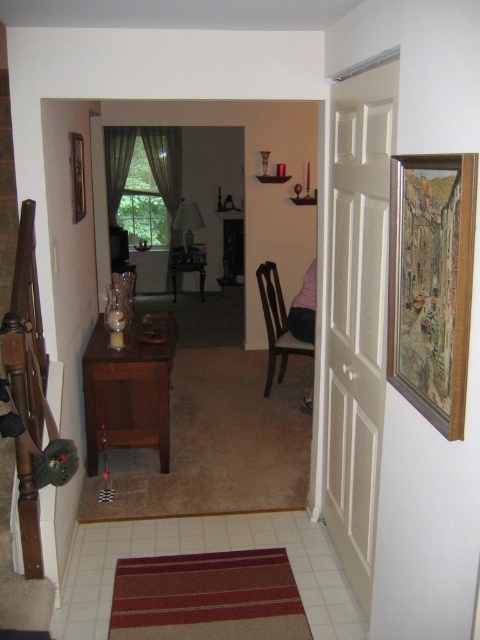
Question: Does matte wood table at center appear on the right side of wooden table at center?

Choices:
 (A) no
 (B) yes

Answer: (B)

Question: Which point is closer to the camera?

Choices:
 (A) (204, 266)
 (B) (113, 390)

Answer: (B)

Question: Which of the following is the closest to the observer?

Choices:
 (A) (171, 272)
 (B) (304, 349)
 (C) (113, 419)

Answer: (C)

Question: Which object is farther from the camera taking this photo?

Choices:
 (A) matte wood table at center
 (B) wooden table at center
 (C) wooden chair at center

Answer: (B)

Question: Can you confirm if matte wood table at center is positioned to the right of wooden table at center?

Choices:
 (A) no
 (B) yes

Answer: (B)

Question: Does matte wood table at center lie behind wooden chair at center?

Choices:
 (A) no
 (B) yes

Answer: (A)